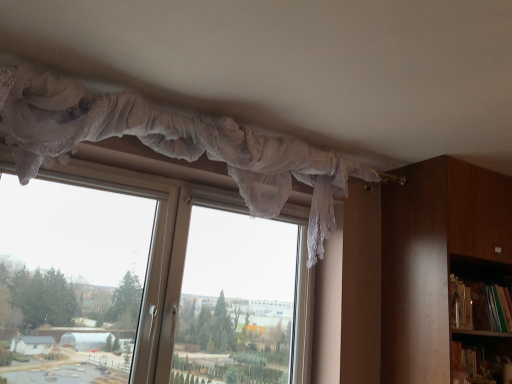
Question: Is transparent lace curtain at upper center smaller than brown wooden bookcase at right?

Choices:
 (A) no
 (B) yes

Answer: (A)

Question: Is transparent lace curtain at upper center not within brown wooden bookcase at right?

Choices:
 (A) yes
 (B) no

Answer: (A)

Question: Does transparent lace curtain at upper center lie in front of brown wooden bookcase at right?

Choices:
 (A) yes
 (B) no

Answer: (A)

Question: Is transparent lace curtain at upper center positioned behind brown wooden bookcase at right?

Choices:
 (A) no
 (B) yes

Answer: (A)

Question: Is transparent lace curtain at upper center oriented away from brown wooden bookcase at right?

Choices:
 (A) yes
 (B) no

Answer: (B)

Question: Considering the relative sizes of transparent lace curtain at upper center and brown wooden bookcase at right in the image provided, is transparent lace curtain at upper center shorter than brown wooden bookcase at right?

Choices:
 (A) yes
 (B) no

Answer: (A)

Question: From the image's perspective, would you say green matte bookshelf at right is shown under brown wooden bookcase at right?

Choices:
 (A) yes
 (B) no

Answer: (A)

Question: Is green matte bookshelf at right at the left side of brown wooden bookcase at right?

Choices:
 (A) no
 (B) yes

Answer: (A)

Question: Is green matte bookshelf at right shorter than brown wooden bookcase at right?

Choices:
 (A) no
 (B) yes

Answer: (B)

Question: Is green matte bookshelf at right completely or partially outside of brown wooden bookcase at right?

Choices:
 (A) no
 (B) yes

Answer: (A)

Question: Is the surface of green matte bookshelf at right in direct contact with brown wooden bookcase at right?

Choices:
 (A) no
 (B) yes

Answer: (A)

Question: Is brown wooden bookcase at right at the back of green matte bookshelf at right?

Choices:
 (A) no
 (B) yes

Answer: (B)

Question: From the image's perspective, is green matte bookshelf at right on transparent lace curtain at upper center?

Choices:
 (A) yes
 (B) no

Answer: (B)